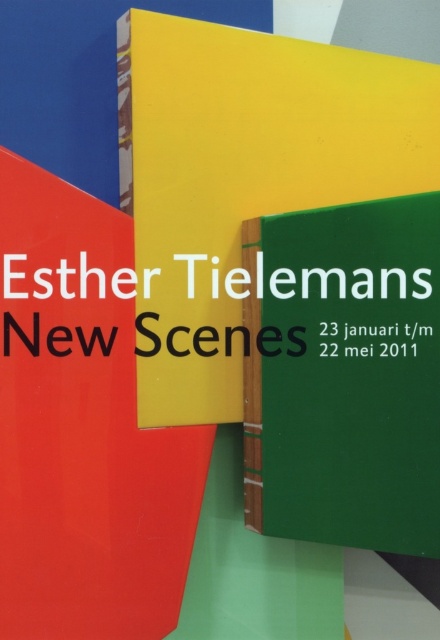
You are an event planner looking at the poster and need to adjust the layout. Since the green matte signboard at center and the black matte text at center are both important, which one should you move forward to ensure the text is more prominent?

The green matte signboard at center is closer to the viewer than the black matte text at center. To make the black matte text at center more prominent, you should move the green matte signboard at center backward so that the black matte text at center comes forward.

You are designing a poster and need to ensure that the green matte signboard at center and the black matte text at center are clearly visible. Based on their sizes, which one should you place higher up to avoid overlap?

Since the green matte signboard at center is bigger than the black matte text at center, you should place the black matte text at center higher up to prevent it from being covered by the larger signboard.

You are an artist trying to paint the scene. You have the matte red book at center and the black paper at center in your view. Which object is closer to you?

The black paper at center is closer to you because the matte red book at center is positioned under it.